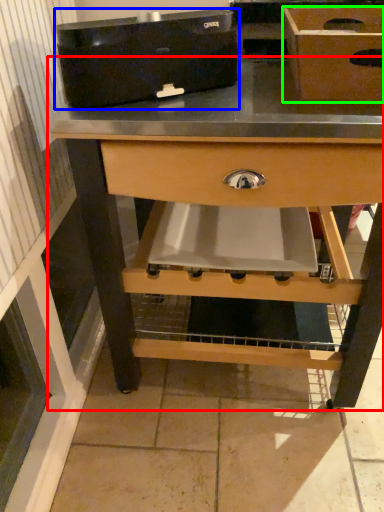
Question: Based on their relative distances, which object is nearer to table (highlighted by a red box)? Choose from appliance (highlighted by a blue box) and box (highlighted by a green box).

Choices:
 (A) appliance
 (B) box

Answer: (A)